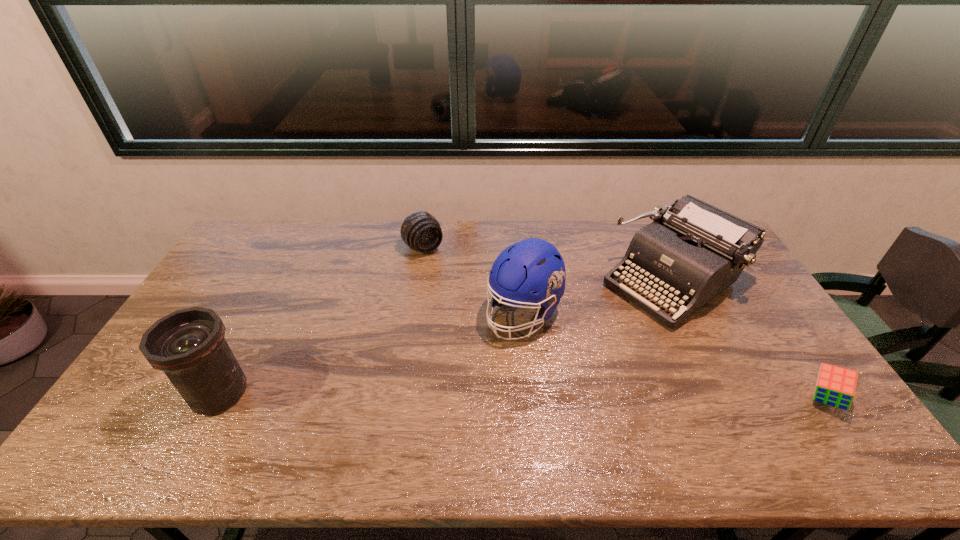
Where is `the taller telephoto lens`? The height and width of the screenshot is (540, 960). the taller telephoto lens is located at coordinates [x=188, y=345].

Where is `the leftmost object`? The height and width of the screenshot is (540, 960). the leftmost object is located at coordinates (188, 345).

The width and height of the screenshot is (960, 540). Identify the location of the shortest object. (x=835, y=386).

I want to click on football helmet, so click(x=533, y=264).

The height and width of the screenshot is (540, 960). What are the coordinates of `typewriter` in the screenshot? It's located at (692, 251).

Where is `the shorter telephoto lens`? The image size is (960, 540). the shorter telephoto lens is located at coordinates (420, 230).

Find the location of a particular element. This screenshot has height=540, width=960. the second shortest object is located at coordinates (420, 230).

Where is `free space located on the back of the leftmost object`? The height and width of the screenshot is (540, 960). free space located on the back of the leftmost object is located at coordinates (256, 322).

Locate an element on the screen. This screenshot has width=960, height=540. vacant space situated on the left of the cube is located at coordinates (660, 398).

Identify the location of vacant space located 0.280m on the front-facing side of the third object from left to right. This screenshot has width=960, height=540. (441, 406).